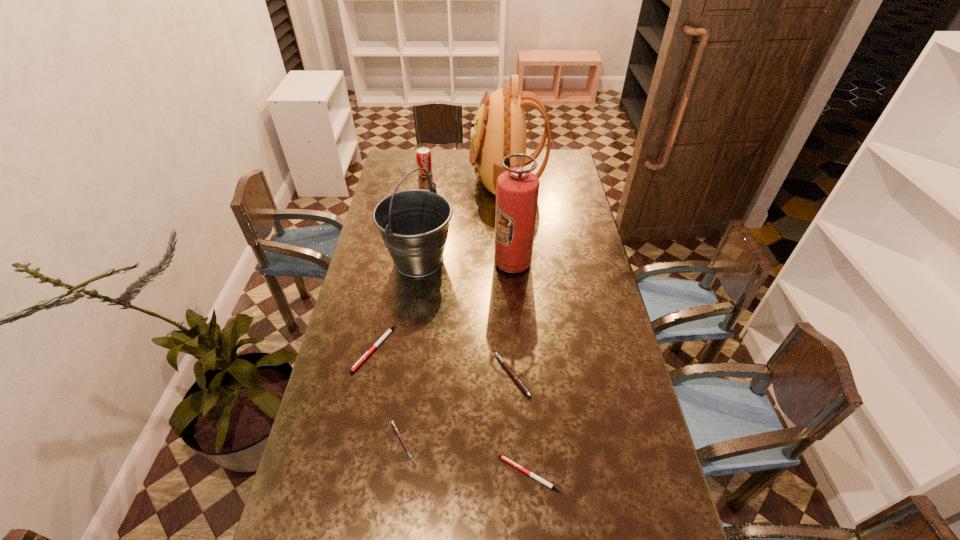
This screenshot has width=960, height=540. I want to click on soda can that is at the far edge, so click(x=423, y=155).

Identify the location of bucket positioned at the left edge. (413, 224).

Find the location of a particular element. The width and height of the screenshot is (960, 540). soda can that is at the left edge is located at coordinates (423, 155).

Locate an element on the screen. pen at the left edge is located at coordinates (388, 331).

Where is `object that is at the right edge`? This screenshot has height=540, width=960. object that is at the right edge is located at coordinates (499, 129).

The width and height of the screenshot is (960, 540). Identify the location of object at the far left corner. (423, 155).

You are a GUI agent. You are given a task and a screenshot of the screen. Output one action in this format:
    pyautogui.click(x=<x>, y=<y>)
    Task: Click on the object located at the far right corner
    
    Given the screenshot: What is the action you would take?
    pyautogui.click(x=499, y=129)

At what (x,y) coordinates should I click in order to perform the action: click on free space at the far edge of the desktop. Please return your answer as a coordinate pair (x, y). The height and width of the screenshot is (540, 960). Looking at the image, I should click on (444, 163).

Where is `blank area at the left edge`? blank area at the left edge is located at coordinates click(394, 288).

The width and height of the screenshot is (960, 540). I want to click on vacant region at the right edge of the desktop, so click(x=552, y=205).